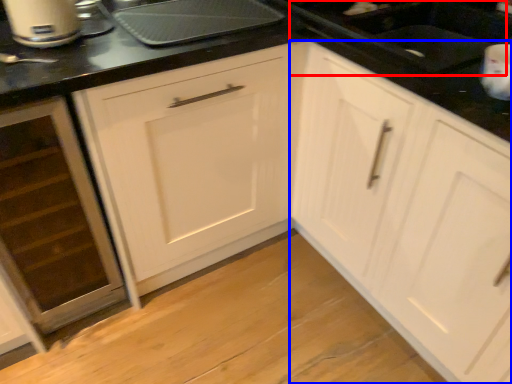
Question: Which object appears closest to the camera in this image, sink (highlighted by a red box) or cabinetry (highlighted by a blue box)?

Choices:
 (A) sink
 (B) cabinetry

Answer: (B)